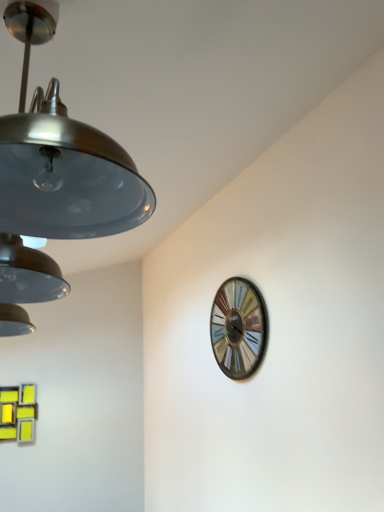
At what (x,y) coordinates should I click in order to perform the action: click on wooden wall clock at upper right. Please return your answer as a coordinate pair (x, y). The height and width of the screenshot is (512, 384). Looking at the image, I should click on (238, 328).

Measure the distance between point (240, 358) and camera.

Point (240, 358) is 2.38 meters away from camera.

Describe the element at coordinates (238, 328) in the screenshot. I see `wooden wall clock at upper right` at that location.

At what (x,y) coordinates should I click in order to perform the action: click on wooden wall clock at upper right. Please return your answer as a coordinate pair (x, y). The image size is (384, 512). Looking at the image, I should click on (238, 328).